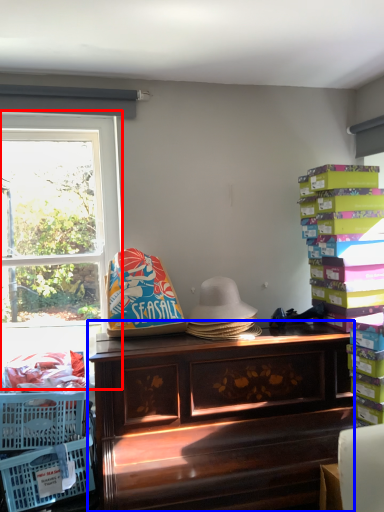
Question: Which point is closer to the camera, window (highlighted by a red box) or desk (highlighted by a blue box)?

Choices:
 (A) window
 (B) desk

Answer: (B)